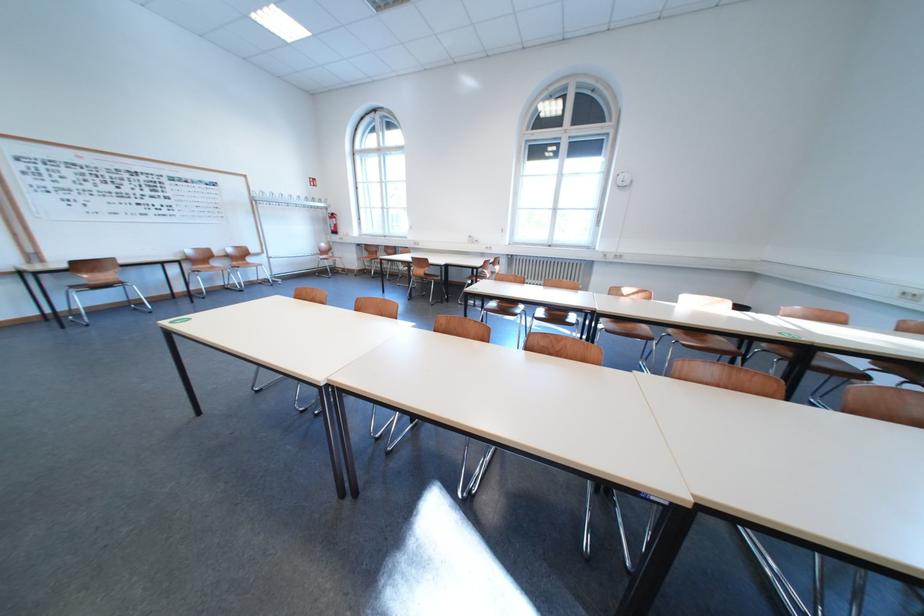
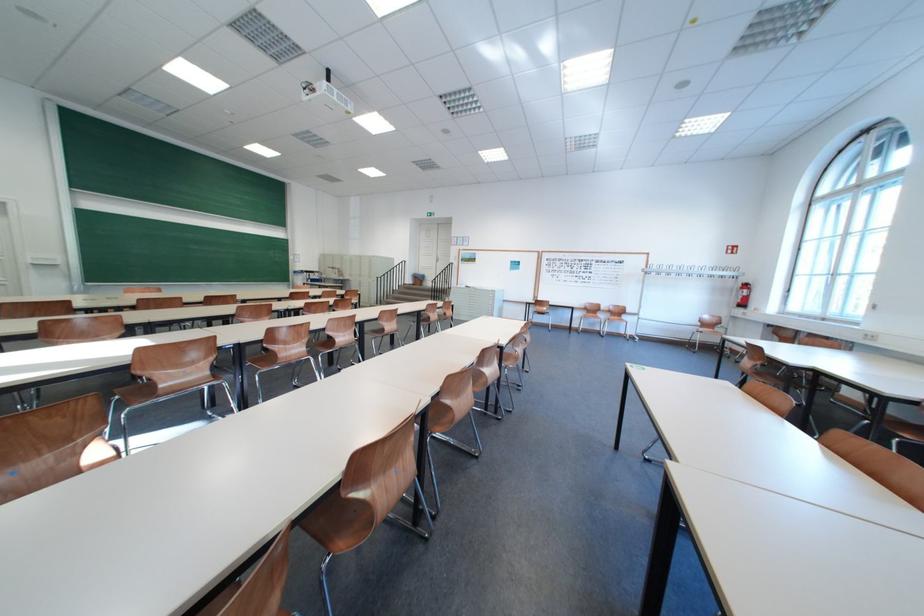
Find the pixel in the second image that matches pixel 248 190 in the first image.

(649, 265)